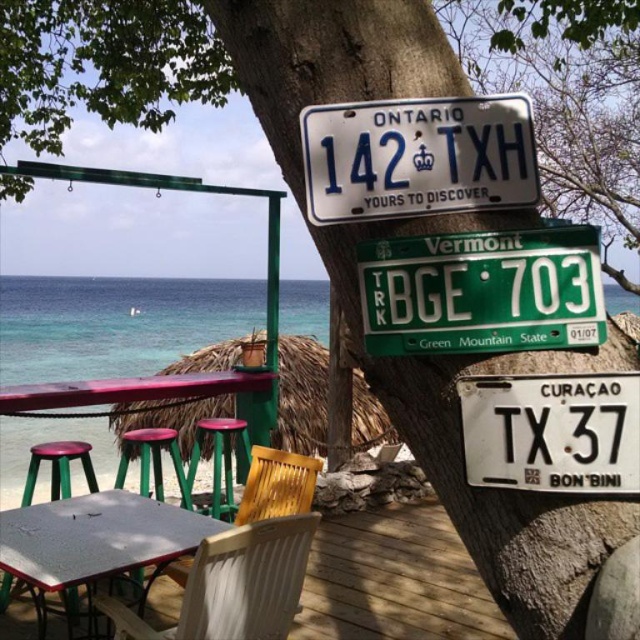
You are a photographer trying to capture the license plates on the tree trunk. You notice two points marked on your screen at coordinates point (225, 550) and point (259, 465). Which point is closer to the camera?

Point (225, 550) is closer to the camera than point (259, 465).

What is the 2D coordinate of the green matte license plate at center?

The green matte license plate at center is located at the 2D coordinate point of [483,291].

You are planning to place a new potted plant on the deck. The plant requires a sunny spot, and the deck is shaded except for an area at coordinates approximately between 0.8 and 0.9 on the x and y axes. Can the white plastic chair at lower center be moved to make space for the plant?

The white plastic chair at lower center is located at point (234,584), which falls within the sunny area between 0.8 and 0.9 on both axes. Moving it would create space for the plant.